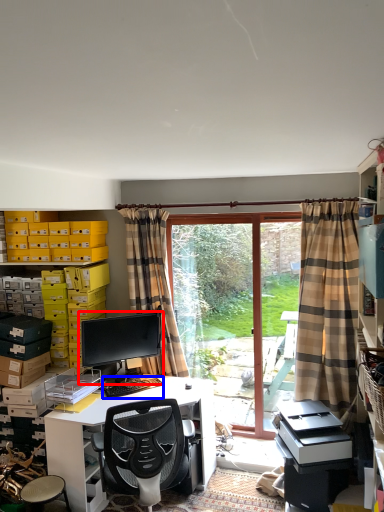
Question: Which object is closer to the camera taking this photo, computer monitor (highlighted by a red box) or computer keyboard (highlighted by a blue box)?

Choices:
 (A) computer monitor
 (B) computer keyboard

Answer: (B)